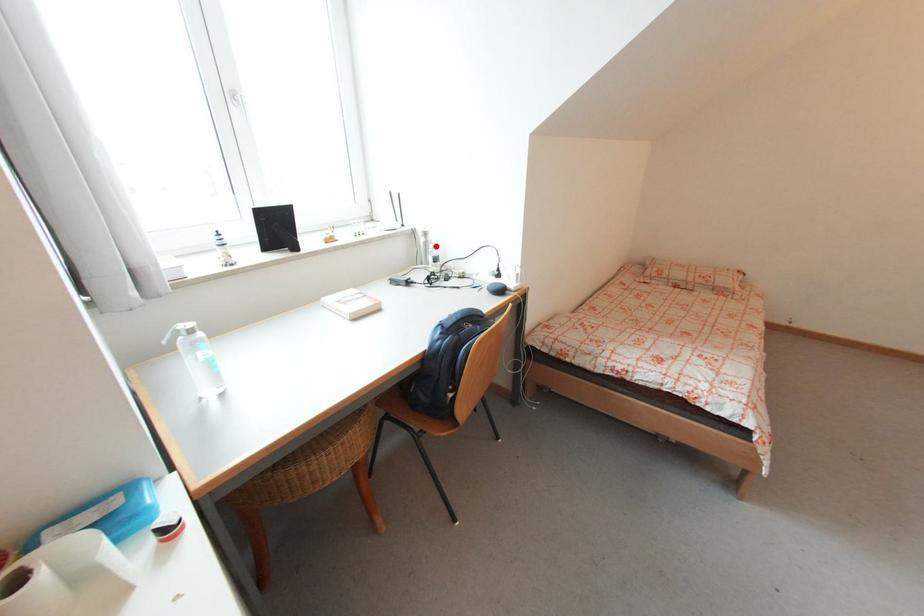
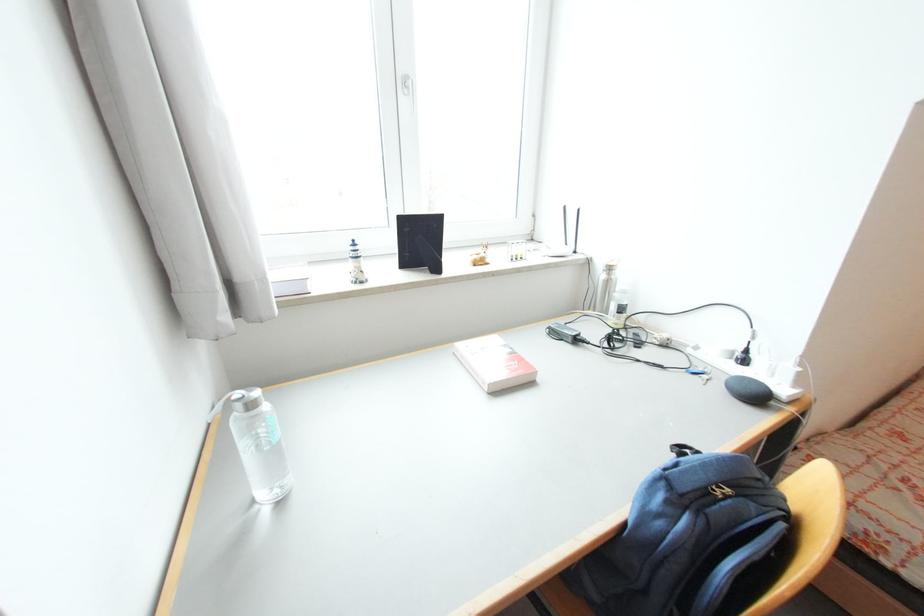
Find the pixel in the second image that matches the highlighted location in the first image.

(623, 288)